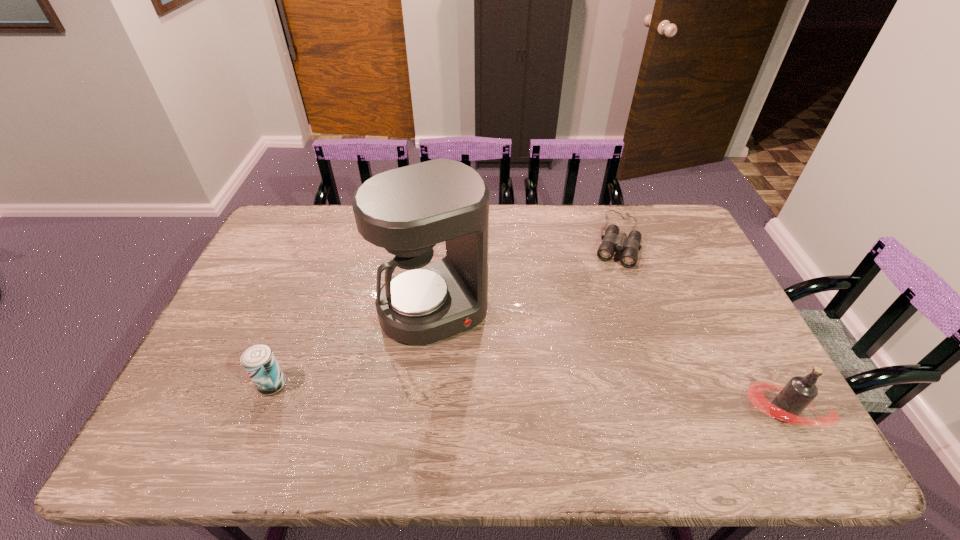
At what (x,y) coordinates should I click in order to perform the action: click on the second shortest object. Please return your answer as a coordinate pair (x, y). This screenshot has width=960, height=540. Looking at the image, I should click on point(258,360).

This screenshot has height=540, width=960. I want to click on the leftmost object, so click(x=258, y=360).

Where is `root beer`? This screenshot has height=540, width=960. root beer is located at coordinates (799, 392).

Where is `the third shortest object`? the third shortest object is located at coordinates (799, 392).

Where is `binoculars`? binoculars is located at coordinates (611, 241).

You are a GUI agent. You are given a task and a screenshot of the screen. Output one action in this format:
    pyautogui.click(x=<x>, y=<y>)
    Task: Click on the shortest object
    This screenshot has height=540, width=960.
    Given the screenshot: What is the action you would take?
    pyautogui.click(x=611, y=241)

At what (x,y) coordinates should I click in order to perform the action: click on the third object from right to left. Please return your answer as a coordinate pair (x, y). This screenshot has width=960, height=540. Looking at the image, I should click on (408, 210).

In order to click on coffee maker in this screenshot , I will do `click(408, 210)`.

Identify the location of vacant region located 0.290m on the right of the beer can. (399, 384).

This screenshot has height=540, width=960. I want to click on vacant space located at the eyepiece of the binoculars, so click(x=607, y=296).